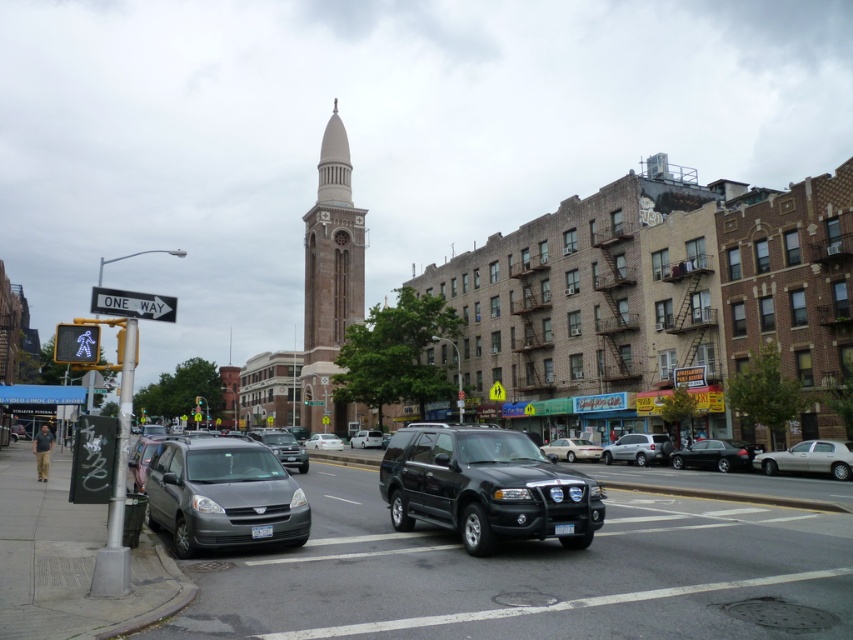
Does matte gray minivan at lower left appear on the right side of light brown stone tower at center?

Correct, you'll find matte gray minivan at lower left to the right of light brown stone tower at center.

Is point (166, 493) positioned behind point (346, 225)?

No, (166, 493) is closer to viewer.

Locate an element on the screen. This screenshot has width=853, height=640. matte gray minivan at lower left is located at coordinates (223, 496).

Is black matte suv at center to the left of white matte van at center from the viewer's perspective?

In fact, black matte suv at center is to the right of white matte van at center.

Find the location of a particular element. Image resolution: width=853 pixels, height=640 pixels. black matte suv at center is located at coordinates (486, 486).

Measure the distance from shiny black sedan at center-right to silver metallic sedan at center-right.

shiny black sedan at center-right is 4.75 meters away from silver metallic sedan at center-right.

Does shiny black sedan at center-right appear over silver metallic sedan at center-right?

Actually, shiny black sedan at center-right is below silver metallic sedan at center-right.

Who is more forward, (737, 445) or (642, 440)?

Point (737, 445) is more forward.

What are the coordinates of `shiny black sedan at center-right` in the screenshot? It's located at (714, 456).